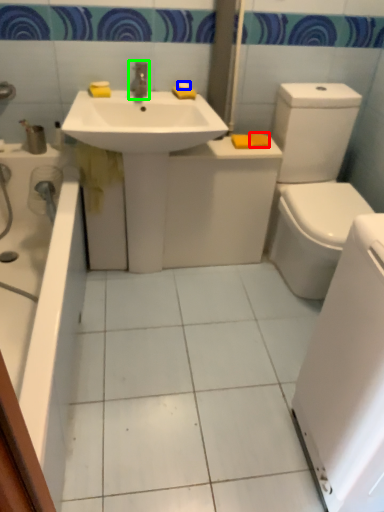
Question: Which object is the closest to the soap (highlighted by a red box)? Choose among these: soap (highlighted by a blue box) or tap (highlighted by a green box).

Choices:
 (A) soap
 (B) tap

Answer: (A)